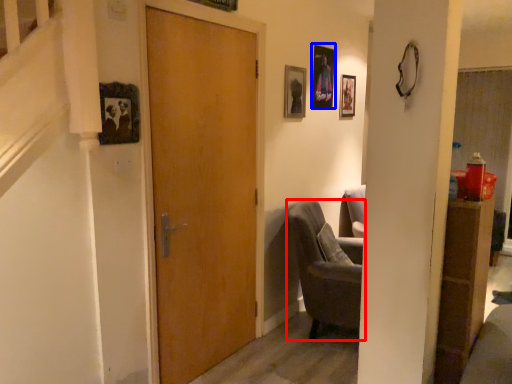
Question: Which object is closer to the camera taking this photo, chair (highlighted by a red box) or picture frame (highlighted by a blue box)?

Choices:
 (A) chair
 (B) picture frame

Answer: (A)